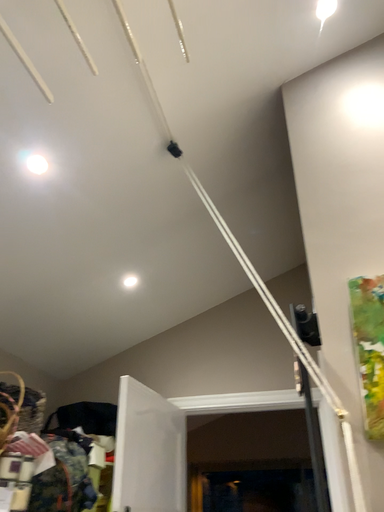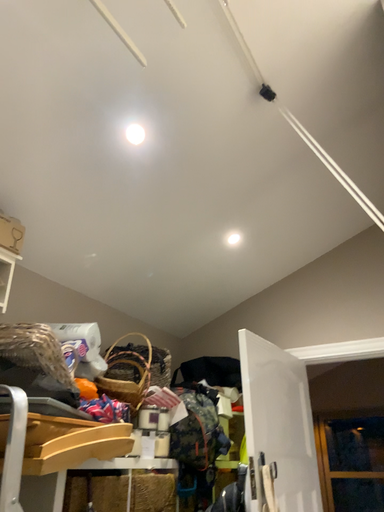
Question: How did the camera likely rotate when shooting the video?

Choices:
 (A) rotated left
 (B) rotated right

Answer: (A)